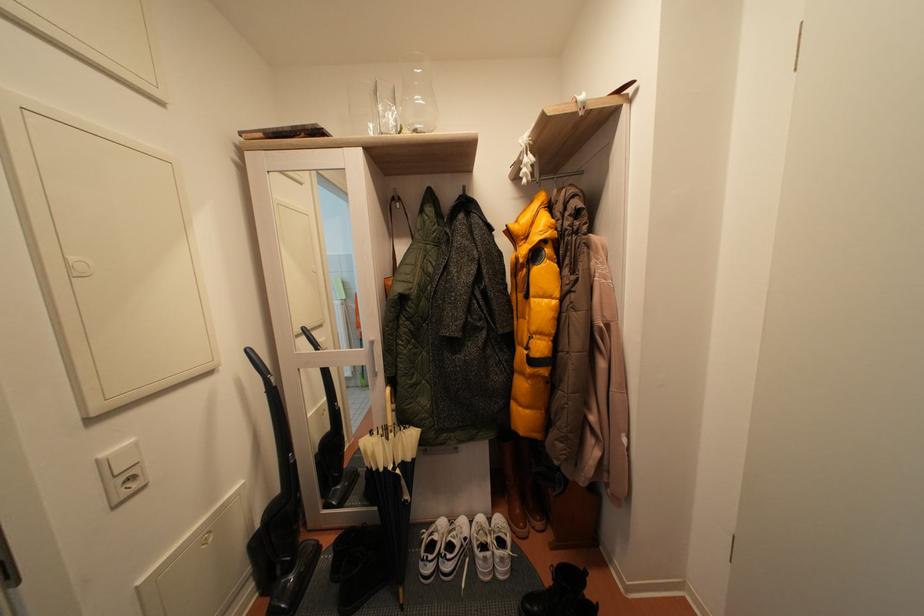
Find where to push the light switch button. Please return your answer as a coordinate pair (x, y).

(122, 458)